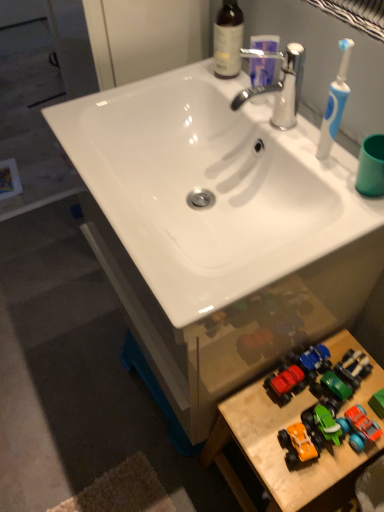
Question: Based on their sizes in the image, would you say white glossy sink at center is bigger or smaller than wooden toy cars at lower right?

Choices:
 (A) small
 (B) big

Answer: (A)

Question: Is point (91, 138) closer or farther from the camera than point (284, 410)?

Choices:
 (A) closer
 (B) farther

Answer: (A)

Question: Considering the real-world distances, which object is closest to the chrome metallic faucet at upper center?

Choices:
 (A) white glossy sink at center
 (B) wooden toy cars at lower right
 (C) orange matte toy car at lower right
 (D) brown glass bottle at upper center

Answer: (D)

Question: Which object is positioned closest to the brown glass bottle at upper center?

Choices:
 (A) white glossy sink at center
 (B) wooden toy cars at lower right
 (C) orange matte toy car at lower right
 (D) chrome metallic faucet at upper center

Answer: (D)